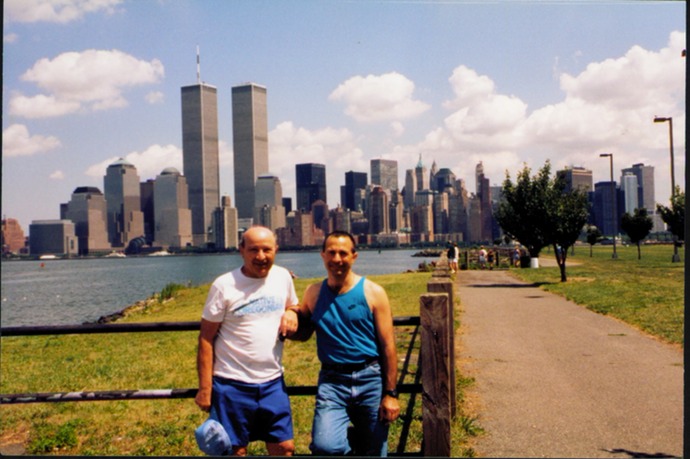
Locate an element on the screen. The height and width of the screenshot is (459, 690). tall lights is located at coordinates (664, 119).